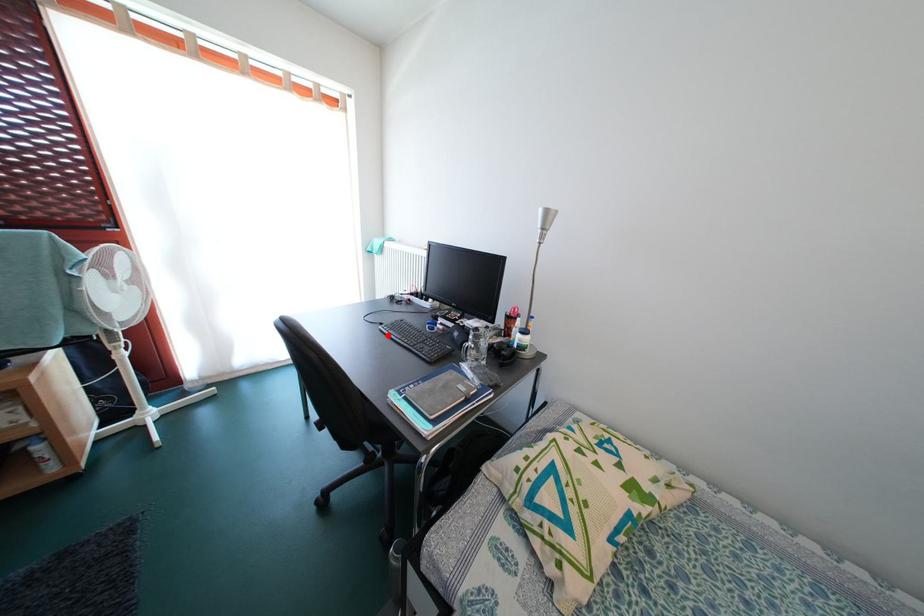
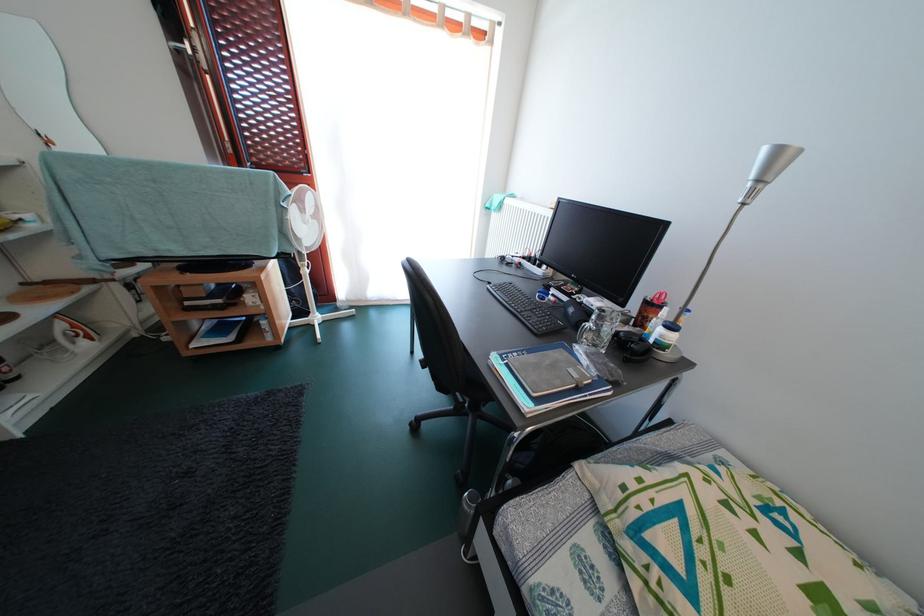
Locate, in the second image, the point that corresponds to the highlighted location in the first image.

(495, 294)